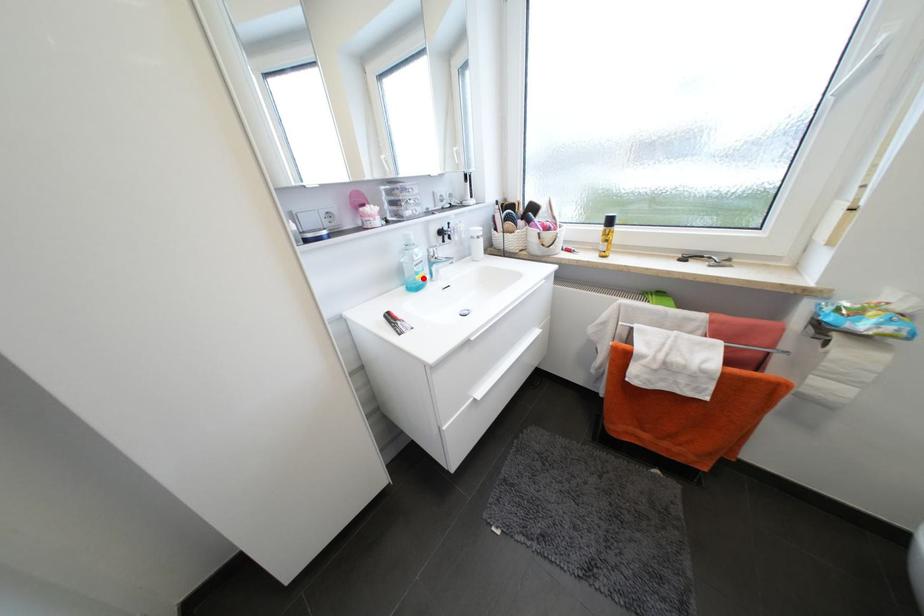
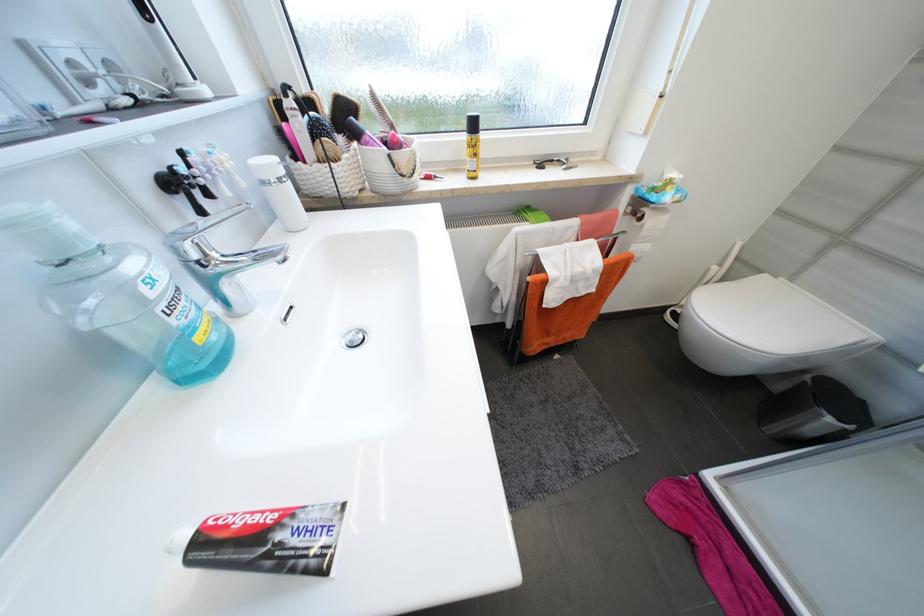
Locate, in the second image, the point that corresponds to the highlighted location in the first image.

(203, 339)